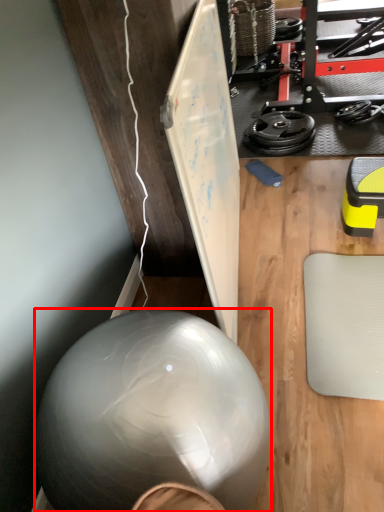
Question: Observing the image, what is the correct spatial positioning of ball (annotated by the red box) in reference to wheel?

Choices:
 (A) right
 (B) left

Answer: (B)